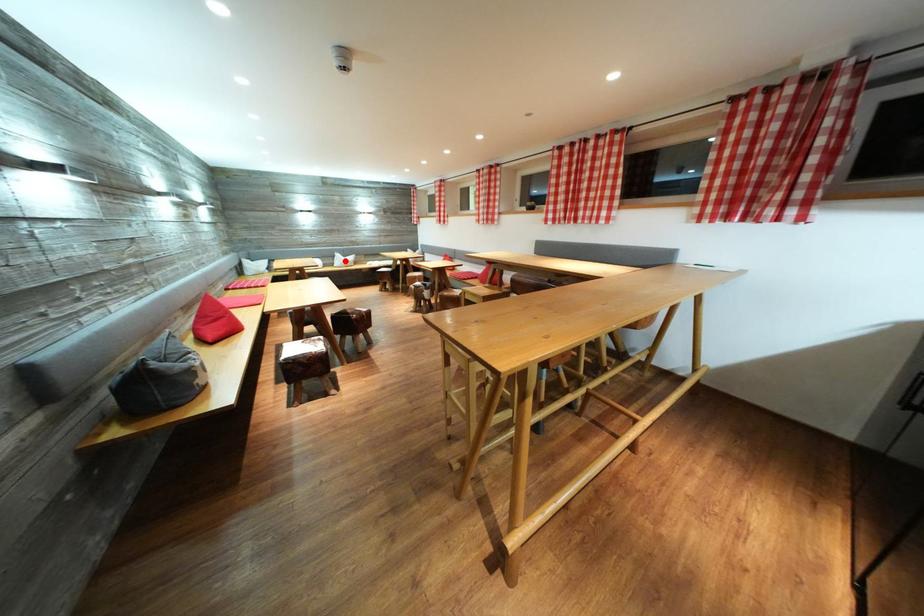
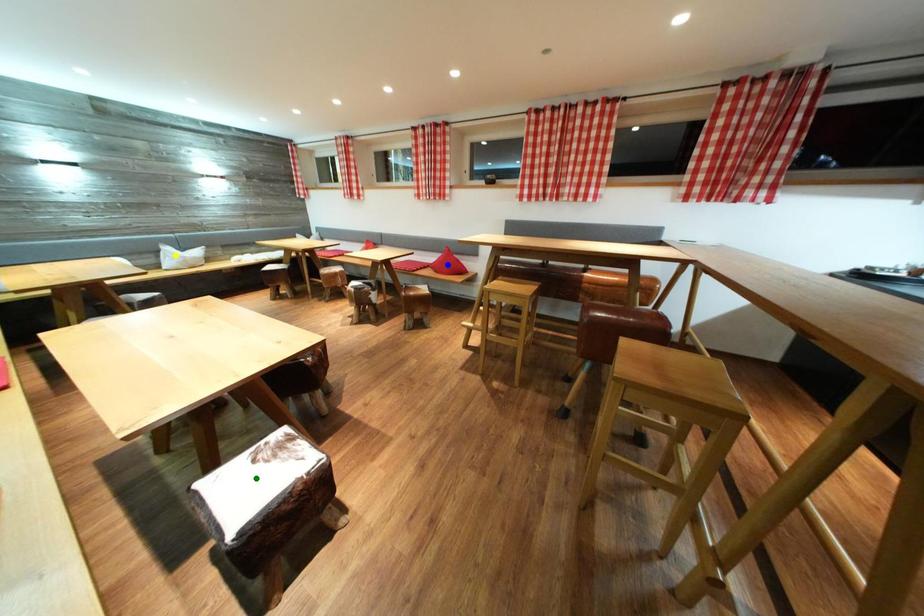
Question: I am providing you with two images of the same scene from different viewpoints. A red point is marked on the first image. You are given multiple points on the second image. Which mark in image 2 goes with the point in image 1?

Choices:
 (A) blue point
 (B) yellow point
 (C) green point

Answer: (B)